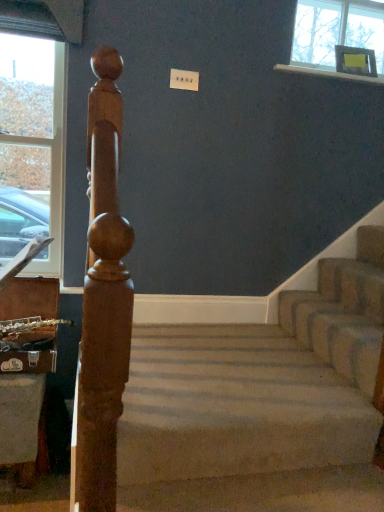
What do you see at coordinates (328, 73) in the screenshot?
I see `white glossy window sill at upper right` at bounding box center [328, 73].

In order to click on beige carpeted stairs at center in this screenshot , I will do `click(262, 403)`.

This screenshot has height=512, width=384. Find the location of `carpeted stairs at center`. carpeted stairs at center is located at coordinates (343, 311).

From the picture: Considering the relative sizes of clear glass window at left and carpeted stairs at center in the image provided, is clear glass window at left wider than carpeted stairs at center?

No.

Choose the correct answer: Is clear glass window at left inside carpeted stairs at center or outside it?

clear glass window at left is not inside carpeted stairs at center, it's outside.

Is clear glass window at left positioned in front of carpeted stairs at center?

No, clear glass window at left is further to the viewer.

Does white glossy window sill at upper right come behind clear glass window at left?

Yes, it is.

From the image's perspective, between white glossy window sill at upper right and clear glass window at left, which one is located above?

white glossy window sill at upper right appears higher in the image.

Is white glossy window sill at upper right aimed at clear glass window at left?

No, white glossy window sill at upper right is not facing towards clear glass window at left.

Considering the relative sizes of white glossy window sill at upper right and clear glass window at left in the image provided, is white glossy window sill at upper right wider than clear glass window at left?

Yes.

Considering the sizes of objects beige carpeted stairs at center and white glossy window sill at upper right in the image provided, who is shorter, beige carpeted stairs at center or white glossy window sill at upper right?

Standing shorter between the two is white glossy window sill at upper right.

Considering the positions of objects beige carpeted stairs at center and white glossy window sill at upper right in the image provided, who is more to the left, beige carpeted stairs at center or white glossy window sill at upper right?

Positioned to the left is beige carpeted stairs at center.

Measure the distance from beige carpeted stairs at center to white glossy window sill at upper right.

beige carpeted stairs at center and white glossy window sill at upper right are 1.49 meters apart from each other.

Considering the positions of objects carpeted stairs at center and beige carpeted stairs at center in the image provided, who is more to the left, carpeted stairs at center or beige carpeted stairs at center?

Positioned to the left is beige carpeted stairs at center.

Which object is further away from the camera, carpeted stairs at center or beige carpeted stairs at center?

Positioned behind is carpeted stairs at center.

Are carpeted stairs at center and beige carpeted stairs at center beside each other?

No, carpeted stairs at center is not with beige carpeted stairs at center.

Does point (118, 377) appear closer or farther from the camera than point (0, 255)?

Point (118, 377).

In the scene shown: Which is correct: polished wood post at left is inside clear glass window at left, or outside of it?

polished wood post at left is not inside clear glass window at left, it's outside.

Is polished wood post at left behind clear glass window at left?

No, it is not.

Who is shorter, clear glass window at left or beige carpeted stairs at center?

With less height is beige carpeted stairs at center.

From the image's perspective, is clear glass window at left located beneath beige carpeted stairs at center?

No.

From the picture: How many degrees apart are the facing directions of clear glass window at left and beige carpeted stairs at center?

They differ by 0.499 degrees in their facing directions.

Is clear glass window at left completely or partially outside of beige carpeted stairs at center?

Indeed, clear glass window at left is completely outside beige carpeted stairs at center.

Considering the sizes of carpeted stairs at center and polished wood post at left in the image, is carpeted stairs at center bigger or smaller than polished wood post at left?

Clearly, carpeted stairs at center is smaller in size than polished wood post at left.

Which object is closer to the camera taking this photo, carpeted stairs at center or polished wood post at left?

Positioned in front is polished wood post at left.

From a real-world perspective, is carpeted stairs at center located beneath polished wood post at left?

Yes, from a real-world perspective, carpeted stairs at center is under polished wood post at left.

Consider the image. Is carpeted stairs at center not close to polished wood post at left?

That's right, there is a large distance between carpeted stairs at center and polished wood post at left.

The image size is (384, 512). Identify the location of window to the left of carpeted stairs at center. (31, 145).

The width and height of the screenshot is (384, 512). Find the location of `window sill that is on the right side of clear glass window at left`. window sill that is on the right side of clear glass window at left is located at coordinates (328, 73).

Looking at the image, which one is located closer to white glossy window sill at upper right, beige carpeted stairs at center or polished wood post at left?

beige carpeted stairs at center is closer to white glossy window sill at upper right.

Estimate the real-world distances between objects in this image. Which object is closer to white glossy window sill at upper right, polished wood post at left or clear glass window at left?

Based on the image, clear glass window at left appears to be nearer to white glossy window sill at upper right.

Estimate the real-world distances between objects in this image. Which object is closer to white glossy window sill at upper right, carpeted stairs at center or beige carpeted stairs at center?

carpeted stairs at center is positioned closer to the anchor white glossy window sill at upper right.

When comparing their distances from beige carpeted stairs at center, does carpeted stairs at center or polished wood post at left seem closer?

Based on the image, carpeted stairs at center appears to be nearer to beige carpeted stairs at center.

Considering their positions, is polished wood post at left positioned further to white glossy window sill at upper right than carpeted stairs at center?

polished wood post at left is further to white glossy window sill at upper right.

From the image, which object appears to be nearer to carpeted stairs at center, white glossy window sill at upper right or beige carpeted stairs at center?

Among the two, beige carpeted stairs at center is located nearer to carpeted stairs at center.

Looking at the image, which one is located further to carpeted stairs at center, clear glass window at left or white glossy window sill at upper right?

clear glass window at left is positioned further to the anchor carpeted stairs at center.

Based on their spatial positions, is carpeted stairs at center or white glossy window sill at upper right closer to clear glass window at left?

white glossy window sill at upper right is closer to clear glass window at left.

I want to click on stairwell between clear glass window at left and white glossy window sill at upper right in the horizontal direction, so click(343, 311).

Where is `window between polished wood post at left and white glossy window sill at upper right along the z-axis`? Image resolution: width=384 pixels, height=512 pixels. window between polished wood post at left and white glossy window sill at upper right along the z-axis is located at coordinates coord(31,145).

At what (x,y) coordinates should I click in order to perform the action: click on stairwell positioned between polished wood post at left and white glossy window sill at upper right from near to far. Please return your answer as a coordinate pair (x, y). Looking at the image, I should click on (343, 311).

Where is `stairs between polished wood post at left and carpeted stairs at center`? The width and height of the screenshot is (384, 512). stairs between polished wood post at left and carpeted stairs at center is located at coordinates (262, 403).